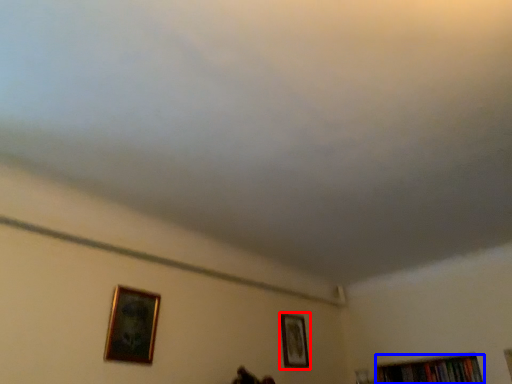
Question: Which object appears closest to the camera in this image, picture frame (highlighted by a red box) or book (highlighted by a blue box)?

Choices:
 (A) picture frame
 (B) book

Answer: (A)